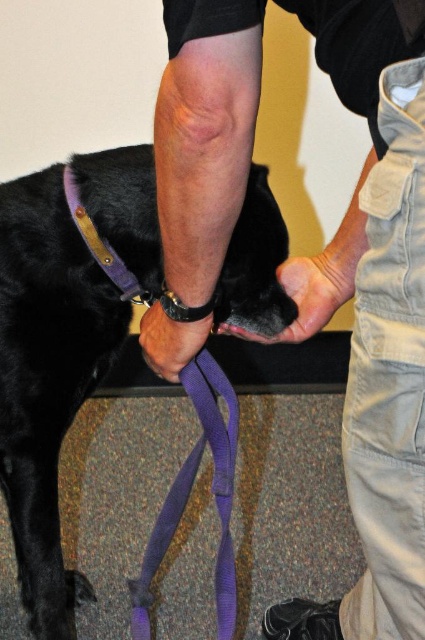
Consider the image. You are a dog trainer holding a purple fabric leash at lower left and a purple fabric strap at center. Which one is bigger?

The purple fabric leash at lower left is larger in size compared to the purple fabric strap at center.

You are a dog owner trying to secure your dog properly. You see the purple fabric leash at lower left and the purple fabric strap at center. Which one is covering the other?

The purple fabric leash at lower left is positioned over the purple fabric strap at center, so it is covering the strap.